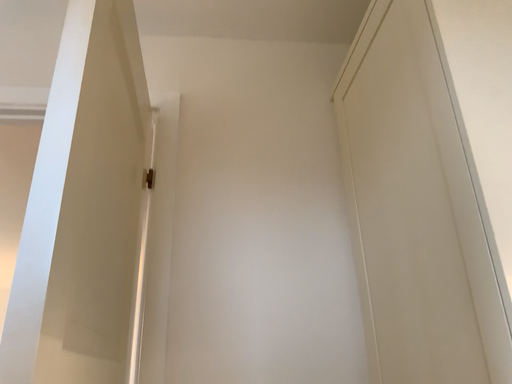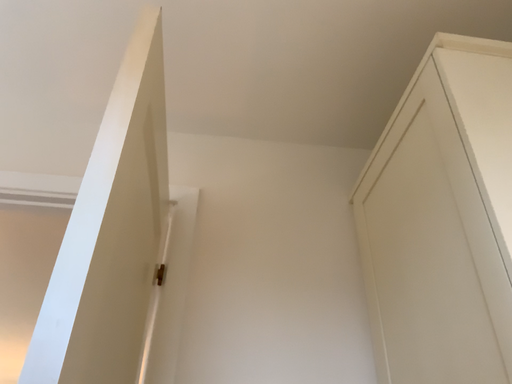
Question: Which way did the camera rotate in the video?

Choices:
 (A) rotated upward
 (B) rotated downward

Answer: (A)